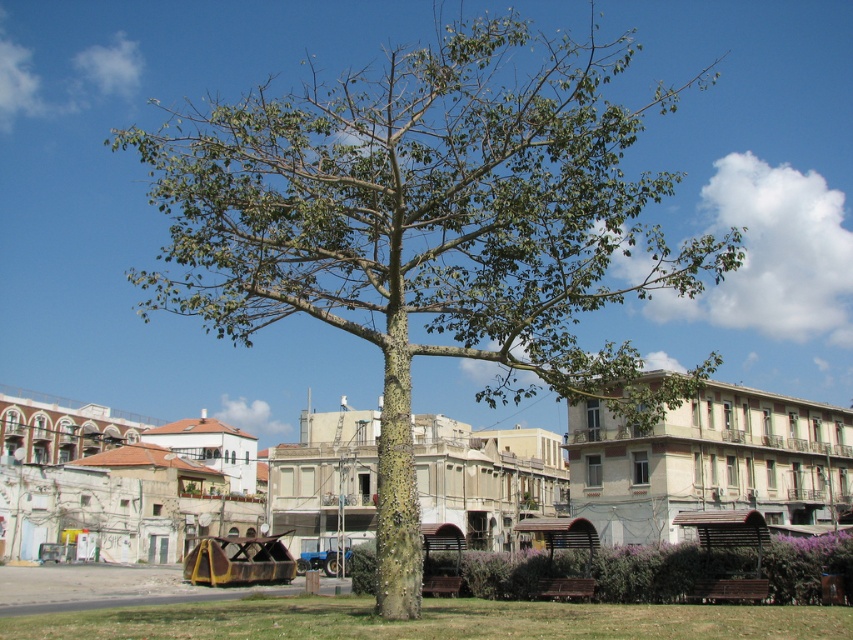
Question: Does green rough bark tree at center have a lesser width compared to green rough tree at center?

Choices:
 (A) yes
 (B) no

Answer: (B)

Question: Among these objects, which one is farthest from the camera?

Choices:
 (A) green rough bark tree at center
 (B) green rough tree at center

Answer: (B)

Question: Can you confirm if green rough bark tree at center is positioned above green rough tree at center?

Choices:
 (A) yes
 (B) no

Answer: (A)

Question: Which of the following is the closest to the observer?

Choices:
 (A) (515, 326)
 (B) (463, 456)

Answer: (A)

Question: Which point is closer to the camera?

Choices:
 (A) (834, 464)
 (B) (375, 129)

Answer: (B)

Question: Is green rough bark tree at center bigger than green rough tree at center?

Choices:
 (A) yes
 (B) no

Answer: (A)